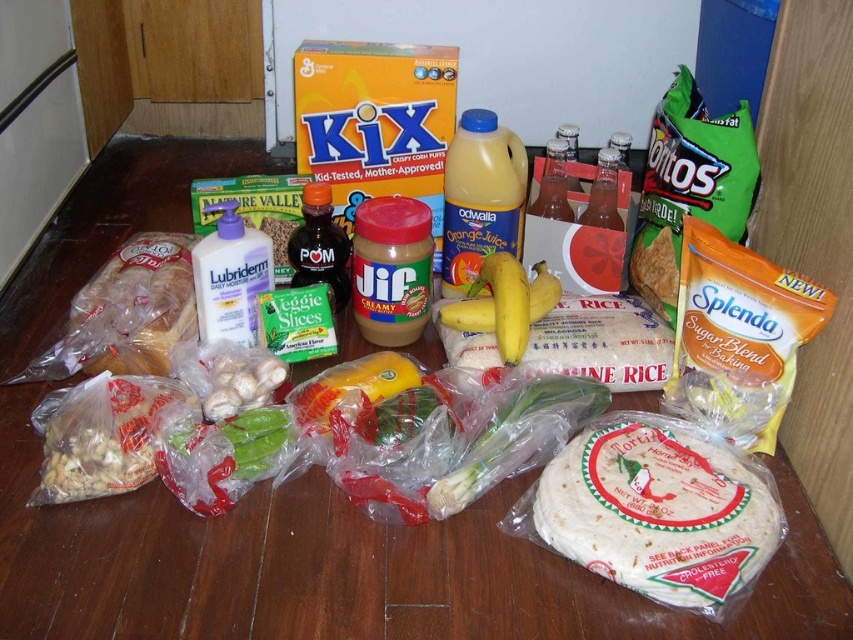
Question: Can you confirm if white paper tortilla at lower right is positioned to the right of yellow translucent bottle at center?

Choices:
 (A) yes
 (B) no

Answer: (A)

Question: Which of the following is the closest to the observer?

Choices:
 (A) (514, 195)
 (B) (590, 532)

Answer: (B)

Question: Which of these objects is positioned closest to the yellow translucent bottle at center?

Choices:
 (A) white paper tortilla at lower right
 (B) creamy peanut butter at center

Answer: (B)

Question: Among these objects, which one is farthest from the camera?

Choices:
 (A) yellow translucent bottle at center
 (B) white paper tortilla at lower right

Answer: (A)

Question: Is yellow translucent bottle at center positioned at the back of creamy peanut butter at center?

Choices:
 (A) yes
 (B) no

Answer: (A)

Question: Is white paper tortilla at lower right further to camera compared to yellow translucent bottle at center?

Choices:
 (A) no
 (B) yes

Answer: (A)